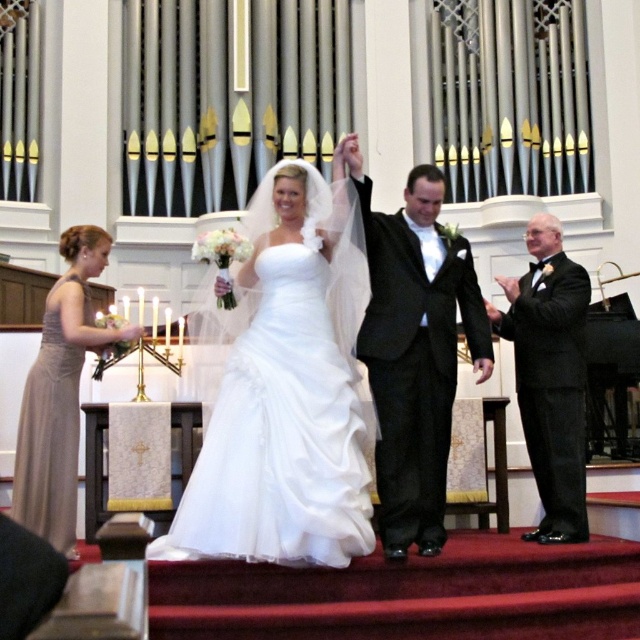
Based on the photo, who is positioned more to the right, white satin dress at center or satin beige dress at lower left?

Positioned to the right is white satin dress at center.

Who is higher up, white satin dress at center or satin beige dress at lower left?

white satin dress at center is above.

Does point (273, 216) come in front of point (120, 339)?

No, (273, 216) is further to viewer.

This screenshot has height=640, width=640. In order to click on white satin dress at center in this screenshot , I will do `click(285, 390)`.

Who is higher up, black satin tuxedo at center or satin/sheer wedding dress at left?

black satin tuxedo at center

Who is more forward, (381, 294) or (51, 492)?

Point (51, 492)

Locate an element on the screen. black satin tuxedo at center is located at coordinates (413, 348).

Does white satin dress at center have a greater height compared to black satin tuxedo at center?

No, white satin dress at center is not taller than black satin tuxedo at center.

In the scene shown: Who is taller, white satin dress at center or black satin tuxedo at center?

With more height is black satin tuxedo at center.

Measure the distance between white satin dress at center and camera.

They are 9.33 meters apart.

Locate an element on the screen. This screenshot has height=640, width=640. white satin dress at center is located at coordinates (285, 390).